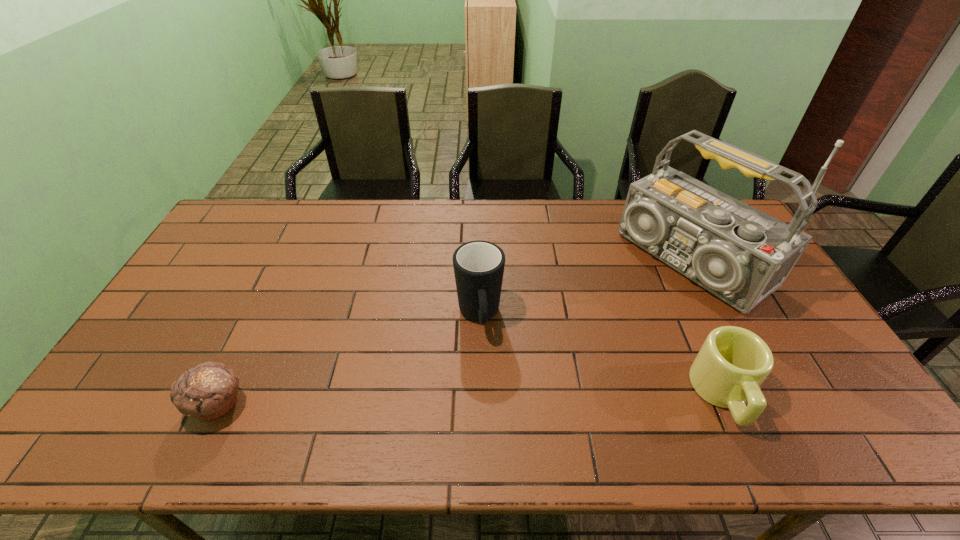
The width and height of the screenshot is (960, 540). What are the coordinates of `muffin` in the screenshot? It's located at (208, 391).

Where is `the leftmost object`? the leftmost object is located at coordinates (208, 391).

You are a GUI agent. You are given a task and a screenshot of the screen. Output one action in this format:
    pyautogui.click(x=<x>, y=<y>)
    Task: Click on the shorter mug
    The height and width of the screenshot is (540, 960).
    Given the screenshot: What is the action you would take?
    pyautogui.click(x=733, y=362)

Locate an element on the screen. This screenshot has width=960, height=540. the right mug is located at coordinates (733, 362).

At what (x,y) coordinates should I click in order to perform the action: click on the tallest object. Please return your answer as a coordinate pair (x, y). The height and width of the screenshot is (540, 960). Looking at the image, I should click on (740, 254).

Image resolution: width=960 pixels, height=540 pixels. In order to click on the farther mug in this screenshot , I will do `click(478, 265)`.

Where is `the left mug`? The image size is (960, 540). the left mug is located at coordinates (478, 265).

Where is `vacant space located on the right of the leftmost object`? vacant space located on the right of the leftmost object is located at coordinates (271, 404).

Find the location of a particular element. free spot located 0.130m on the front-facing side of the tallest object is located at coordinates (621, 312).

The width and height of the screenshot is (960, 540). Identify the location of vacant area situated 0.390m on the front-facing side of the tallest object. (557, 354).